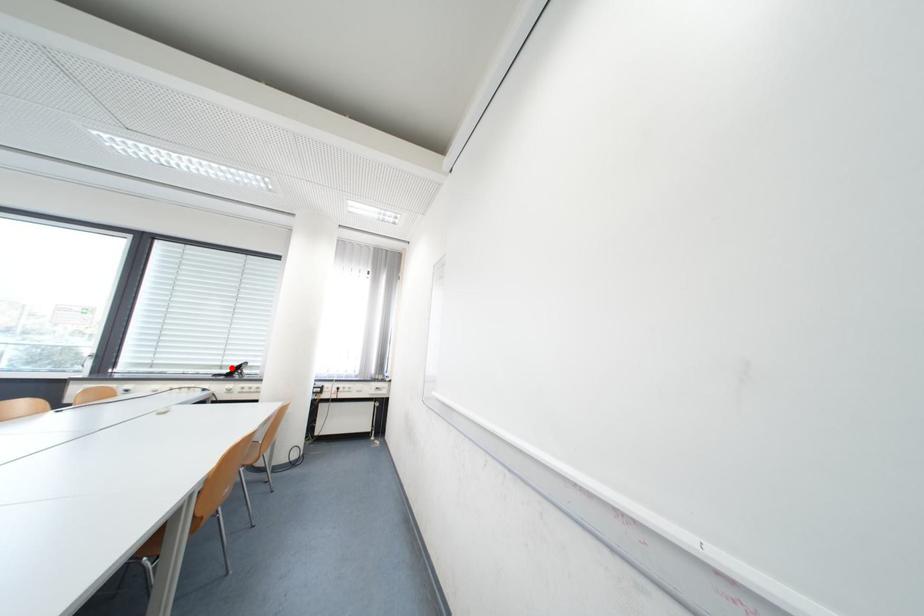
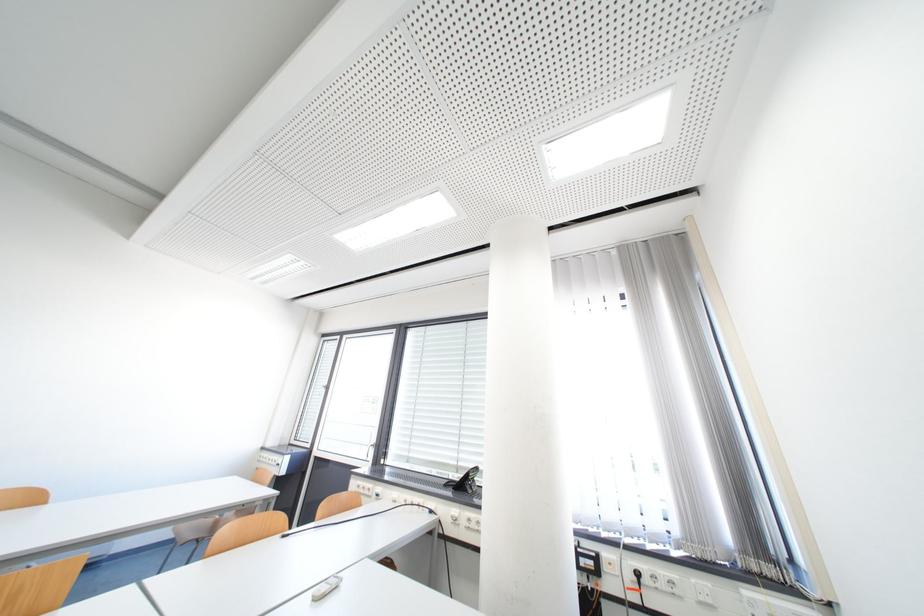
In the second image, find the point that corresponds to the highlighted location in the first image.

(468, 469)